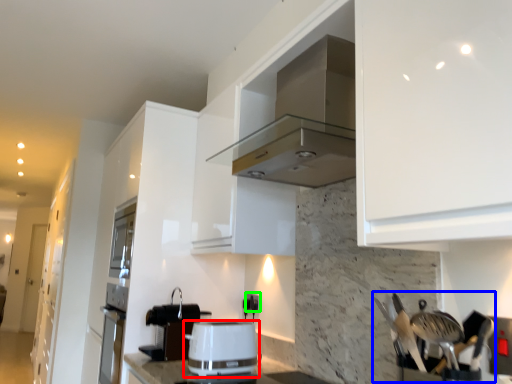
Question: Which object is the closest to the kitchen appliance (highlighted by a red box)? Choose among these: silverware (highlighted by a blue box) or electric outlet (highlighted by a green box).

Choices:
 (A) silverware
 (B) electric outlet

Answer: (B)